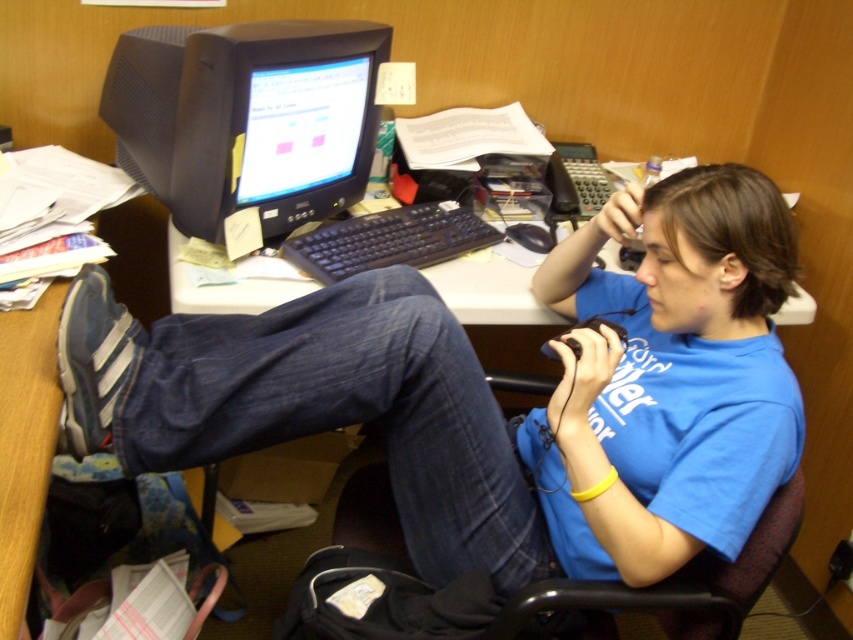
Can you confirm if matte black monitor at center is bigger than black plastic keyboard at center?

Yes.

Can you confirm if matte black monitor at center is wider than black plastic keyboard at center?

Incorrect, matte black monitor at center's width does not surpass black plastic keyboard at center's.

Is point (323, 156) farther from viewer compared to point (310, 237)?

Yes, it is.

Identify the location of matte black monitor at center. Image resolution: width=853 pixels, height=640 pixels. (274, 122).

Is point (262, 138) closer to viewer compared to point (297, 280)?

Yes, it is.

Between matte black monitor at center and white plastic table at center, which one appears on the left side from the viewer's perspective?

matte black monitor at center

Identify the location of matte black monitor at center. (274, 122).

Does white plastic table at center have a smaller size compared to black plastic keyboard at center?

Indeed, white plastic table at center has a smaller size compared to black plastic keyboard at center.

Can you confirm if white plastic table at center is positioned above black plastic keyboard at center?

No, white plastic table at center is not above black plastic keyboard at center.

Between point (502, 276) and point (402, 234), which one is positioned behind?

The point (402, 234) is more distant.

Find the location of a particular element. This screenshot has height=640, width=853. white plastic table at center is located at coordinates (489, 292).